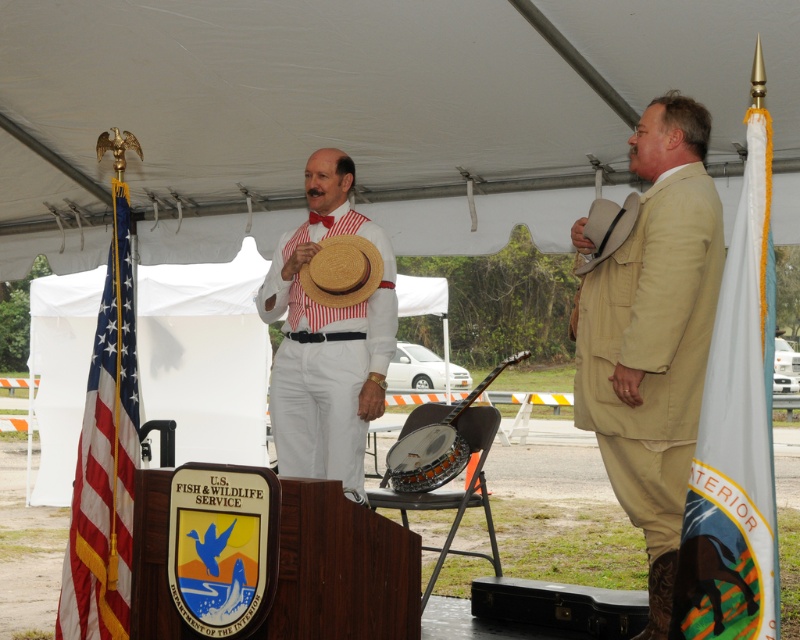
Does white striped fabric at center appear under metallic brown banjo at center?

No.

Who is more distant from viewer, (302, 291) or (441, 458)?

Point (441, 458)

Between point (364, 307) and point (402, 464), which one is positioned in front?

Point (364, 307) is in front.

At what (x,y) coordinates should I click in order to perform the action: click on white striped fabric at center. Please return your answer as a coordinate pair (x, y). This screenshot has width=800, height=640. Looking at the image, I should click on (328, 339).

Consider the image. Between metallic brown banjo at center and strawmaterial/texturehat at upper right, which one has more height?

strawmaterial/texturehat at upper right is taller.

Does point (413, 464) come behind point (616, 216)?

Yes, point (413, 464) is behind point (616, 216).

Who is more forward, (420, 406) or (596, 216)?

Point (596, 216) is more forward.

Where is `metallic brown banjo at center`? metallic brown banjo at center is located at coordinates (436, 444).

In the scene shown: Between metallic brown banjo at center and strawhat at center, which one has more height?

strawhat at center is taller.

Is point (450, 461) in front of point (328, 243)?

No, (450, 461) is behind (328, 243).

At what (x,y) coordinates should I click in order to perform the action: click on metallic brown banjo at center. Please return your answer as a coordinate pair (x, y). The height and width of the screenshot is (640, 800). Looking at the image, I should click on (436, 444).